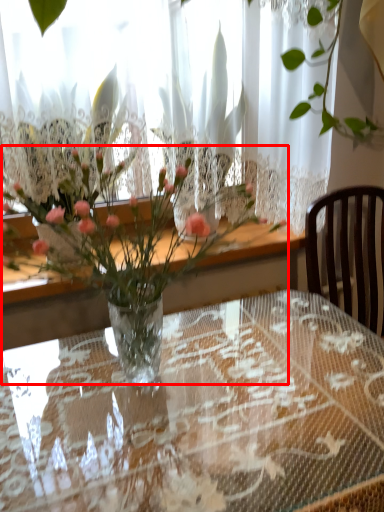
Question: From the image's perspective, considering the relative positions of bouquet (annotated by the red box) and table in the image provided, where is bouquet (annotated by the red box) located with respect to the staircase?

Choices:
 (A) below
 (B) above

Answer: (B)